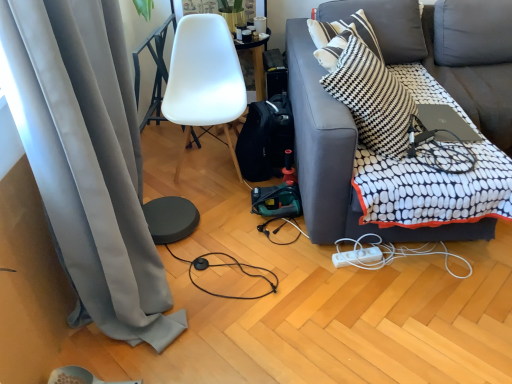
Identify the location of vacant area that lies in front of white plastic power outlet at lower center. Image resolution: width=512 pixels, height=384 pixels. (364, 289).